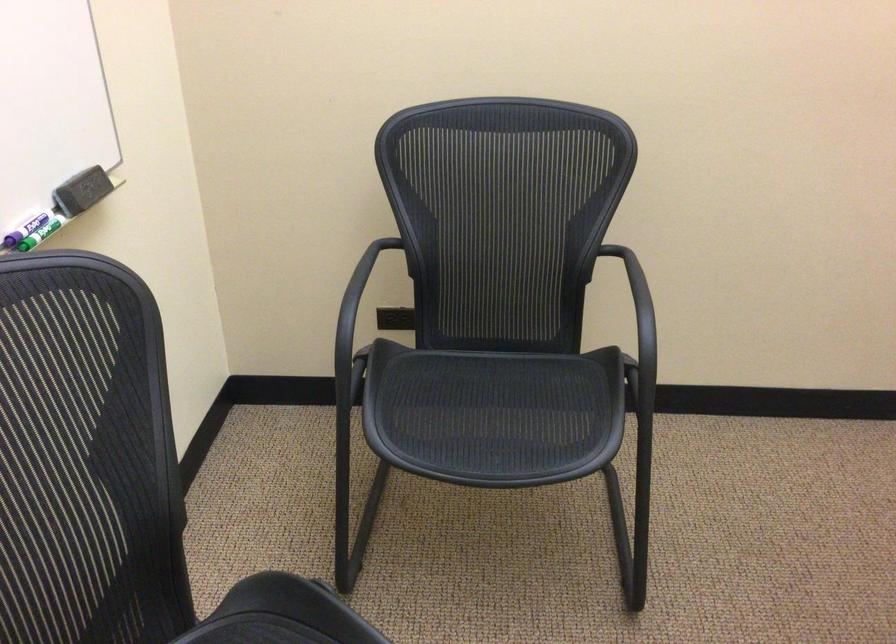
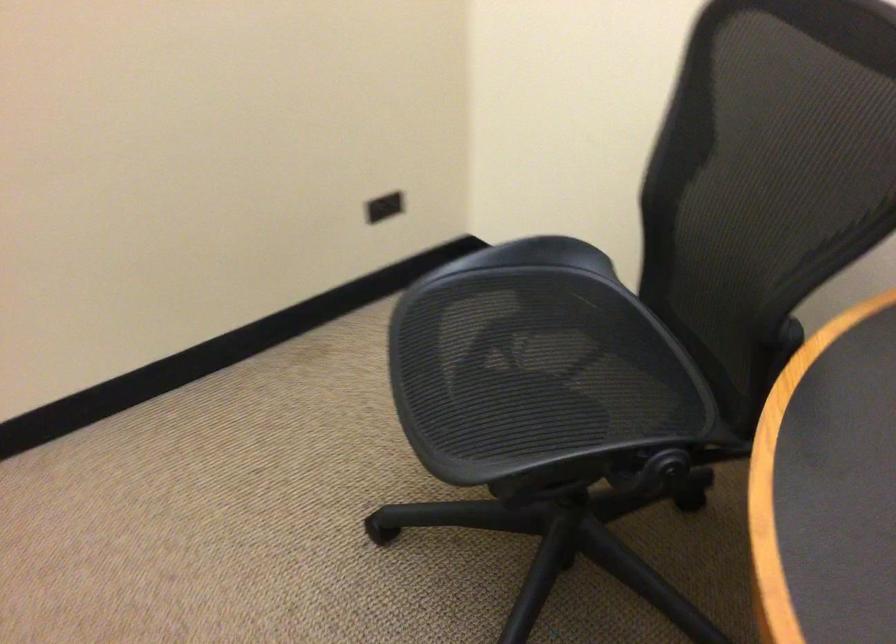
Question: The camera is either moving clockwise (left) or counter-clockwise (right) around the object. The first image is from the beginning of the video and the second image is from the end. Is the camera moving left or right when shooting the video?

Choices:
 (A) Left
 (B) Right

Answer: (A)